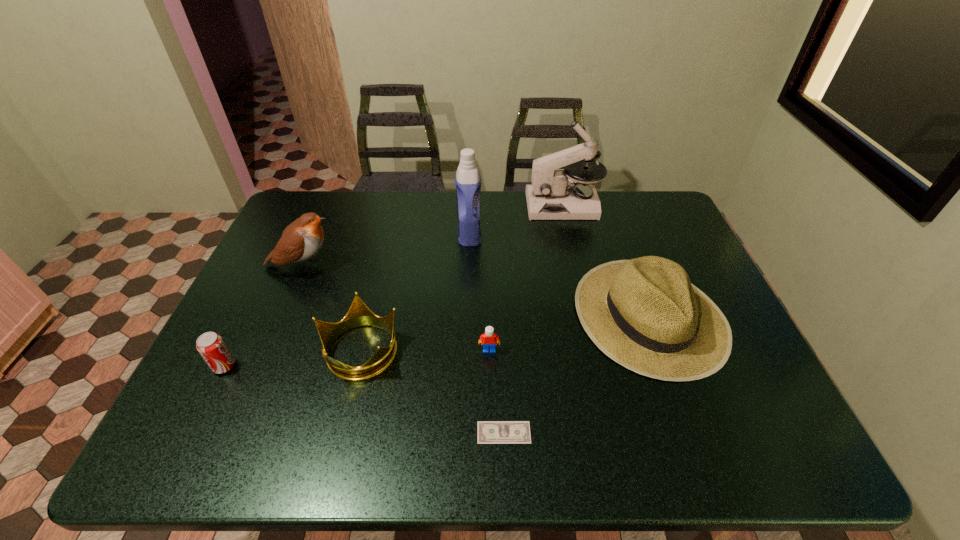
This screenshot has height=540, width=960. I want to click on blank area located at the eyepiece of the microscope, so click(x=422, y=206).

Locate an element on the screen. This screenshot has height=540, width=960. free space located 0.060m at the eyepiece of the microscope is located at coordinates (511, 206).

At what (x,y) coordinates should I click in order to perform the action: click on vacant area situated on the right of the detergent. Please return your answer as a coordinate pair (x, y). Looking at the image, I should click on (530, 233).

You are a GUI agent. You are given a task and a screenshot of the screen. Output one action in this format:
    pyautogui.click(x=<x>, y=<y>)
    Task: Click on the free region located 0.220m at the face of the bird
    The width and height of the screenshot is (960, 540).
    Given the screenshot: What is the action you would take?
    pyautogui.click(x=413, y=266)

This screenshot has height=540, width=960. I want to click on vacant space located 0.220m on the left of the fifth shortest object, so click(x=494, y=315).

Identify the location of free region located 0.370m on the right of the sixth object from right to left. (546, 349).

Where is `vacant space situated on the logo side of the soda can`? vacant space situated on the logo side of the soda can is located at coordinates (392, 366).

The image size is (960, 540). In order to click on vacant space located on the face of the seventh tallest object in this screenshot , I will do `click(491, 433)`.

Find the location of `vacant region located on the back of the shortest object`. vacant region located on the back of the shortest object is located at coordinates (499, 312).

Locate an element on the screen. Image resolution: width=960 pixels, height=540 pixels. microscope that is positioned at the far edge is located at coordinates (551, 196).